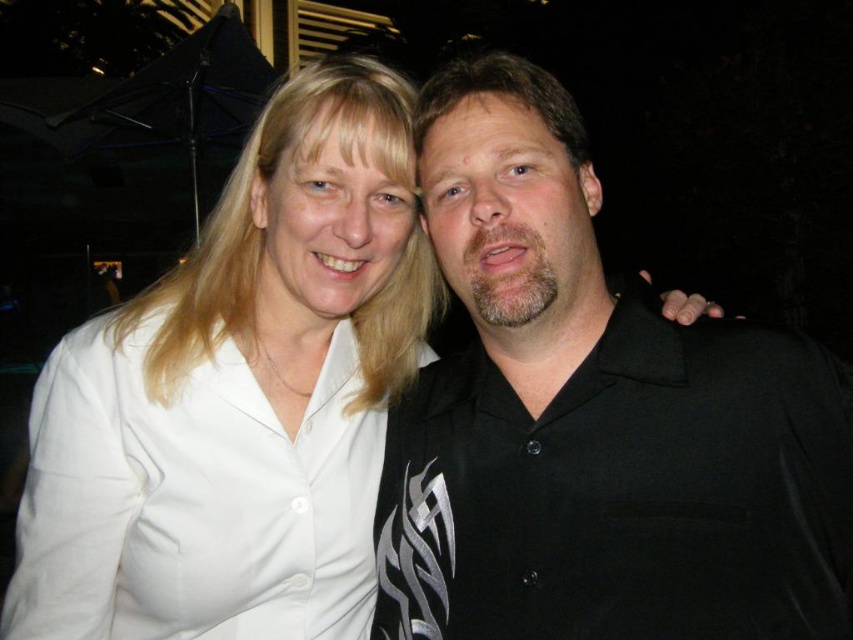
You are a photographer adjusting the lighting for a night portrait. You notice the black matte shirt at center and the white smooth shirt at upper left. Which shirt requires more light to ensure it appears properly exposed in the photo?

The black matte shirt at center requires more light because it has a larger width than the white smooth shirt at upper left, making it cover more area and potentially absorb more light.

You are a photographer trying to adjust the focus of your camera. You have two points in the image to focus on, point (746, 422) and point (189, 540). Which point should you focus on first if you want to prioritize the closer object?

Point (746, 422) is closer to the viewer than point (189, 540), so you should focus on point (746, 422) first to prioritize the closer object.

You are standing at the point marked as point (525, 228) in the image. You want to throw a small ball to your friend who is standing exactly where the viewer is positioned. The ball has a maximum throwing distance of 1.5 meters. Will you be able to reach your friend with this throw?

The distance between point (525, 228) and the viewer is 1.42 meters. Since the ball can travel up to 1.5 meters, you can successfully throw it to your friend at the viewer position.